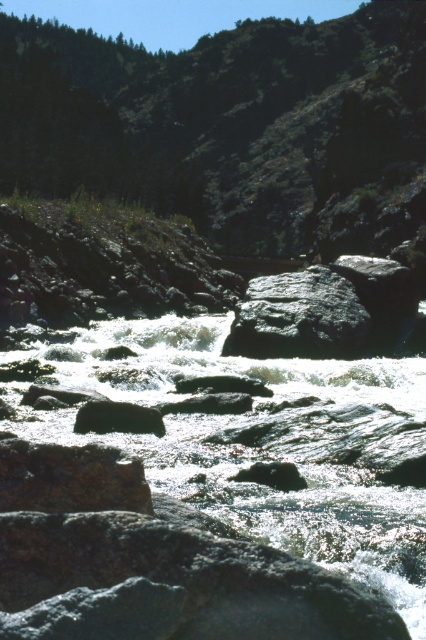
Question: Which object appears farthest from the camera in this image?

Choices:
 (A) green grassy hillside at upper center
 (B) white frothy water at center

Answer: (A)

Question: Is green grassy hillside at upper center bigger than white frothy water at center?

Choices:
 (A) no
 (B) yes

Answer: (B)

Question: Among these objects, which one is farthest from the camera?

Choices:
 (A) green grassy hillside at upper center
 (B) white frothy water at center

Answer: (A)

Question: Which point is farther to the camera?

Choices:
 (A) green grassy hillside at upper center
 (B) white frothy water at center

Answer: (A)

Question: Can you confirm if green grassy hillside at upper center is bigger than white frothy water at center?

Choices:
 (A) yes
 (B) no

Answer: (A)

Question: Can you confirm if green grassy hillside at upper center is positioned below white frothy water at center?

Choices:
 (A) yes
 (B) no

Answer: (B)